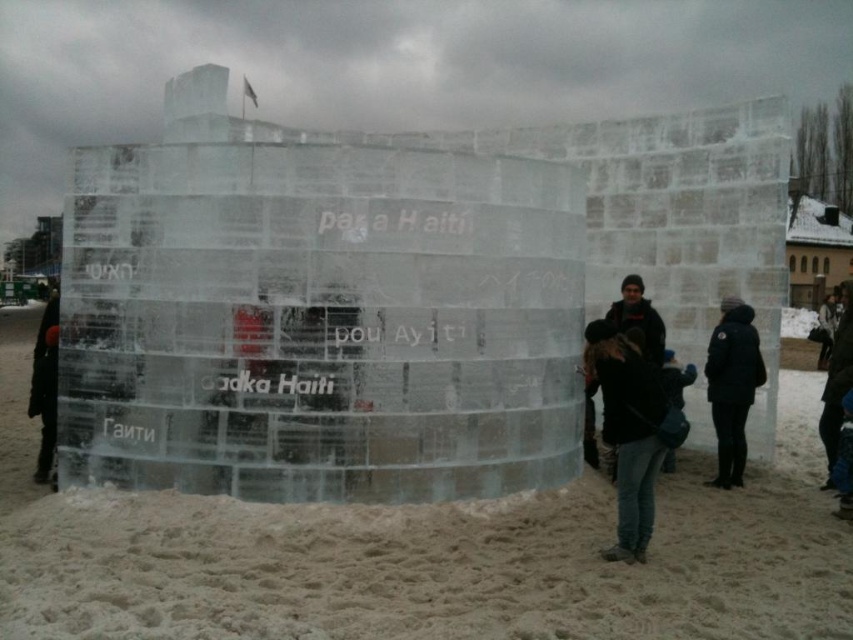
You are a photographer standing in the snowy environment and want to take a photo of the white sand at lower center and dark blue jeans at lower right. Can you position yourself so that both objects are in the same frame without moving either object? Explain why or why not based on their distance.

The distance between the white sand at lower center and dark blue jeans at lower right is 4.74 feet. Since the photographer can adjust their position to include both objects within the camera frame, it is possible to capture both in the same photo as long as the camera lens has a wide enough angle or the photographer steps back sufficiently to encompass both objects separated by that distance.

You are standing in front of the ice sculpture and want to place a small souvenir on the white sand at lower center. However, there is a black matte jacket at right nearby. To ensure the souvenir is visible, which object should you place it closer to?

You should place the souvenir closer to the white sand at lower center because it is positioned on the left side of the black matte jacket at right, making it a better location for visibility.